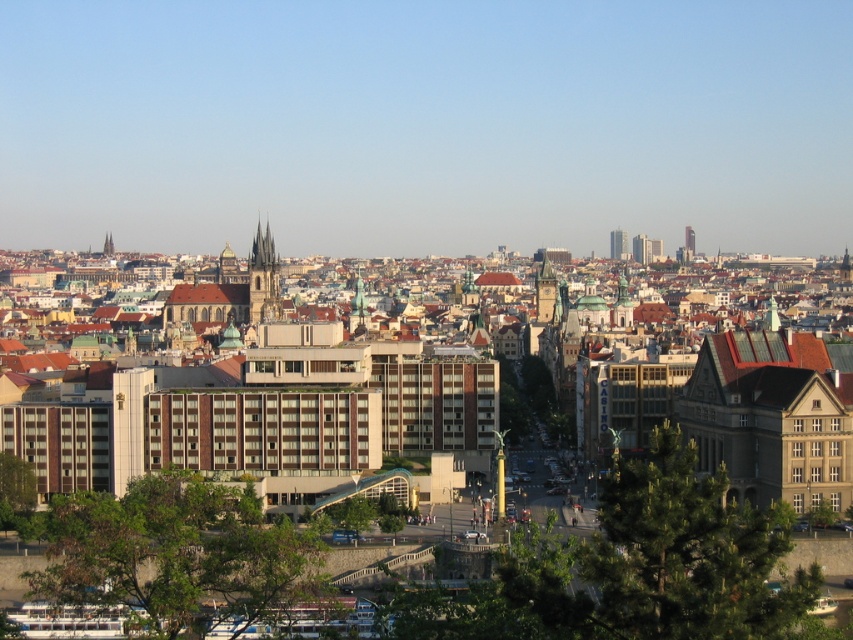
Question: Which of these objects is positioned farthest from the golden stone clock tower at center?

Choices:
 (A) dark brown stone tower at center-left
 (B) brown stone tower at upper center

Answer: (B)

Question: Does glassy modern skyscraper at upper right have a larger size compared to brown stone tower at upper center?

Choices:
 (A) yes
 (B) no

Answer: (B)

Question: Which point appears farthest from the camera in this image?

Choices:
 (A) (109, 243)
 (B) (540, 276)

Answer: (A)

Question: Which point is farther to the camera?

Choices:
 (A) brown stone tower at upper center
 (B) glassy skyscraper at upper right
 (C) golden stone clock tower at center
 (D) glassy modern skyscraper at upper right

Answer: (D)

Question: Is glassy skyscraper at upper right closer to camera compared to brown stone tower at upper center?

Choices:
 (A) no
 (B) yes

Answer: (A)

Question: Considering the relative positions of dark brown stone tower at center-left and glassy skyscraper at upper right in the image provided, where is dark brown stone tower at center-left located with respect to glassy skyscraper at upper right?

Choices:
 (A) right
 (B) left

Answer: (B)